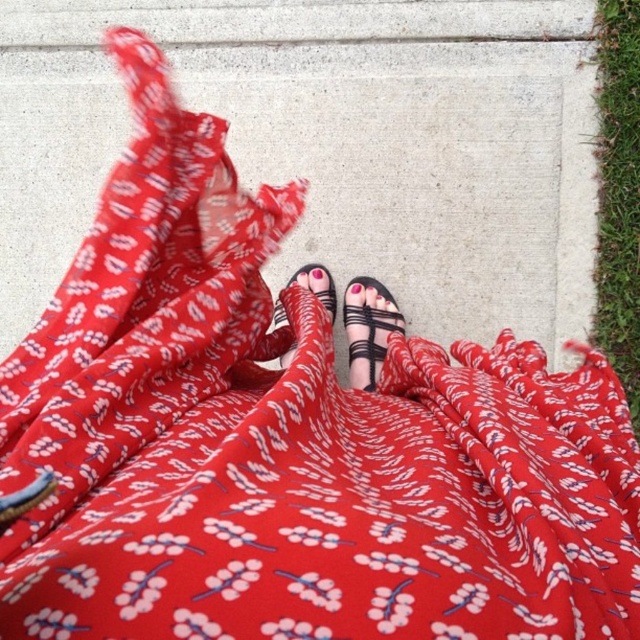
Question: Estimate the real-world distances between objects in this image. Which object is farther from the matte black sandal at center?

Choices:
 (A) green grass at right
 (B) black leather sandal at lower center

Answer: (A)

Question: Can you confirm if black leather sandal at lower center is positioned above matte black sandal at center?

Choices:
 (A) yes
 (B) no

Answer: (B)

Question: Which point is closer to the camera?

Choices:
 (A) black leather sandal at lower center
 (B) matte black sandal at center
 (C) green grass at right

Answer: (B)

Question: Which is farther from the green grass at right?

Choices:
 (A) matte black sandal at center
 (B) black leather sandal at lower center

Answer: (A)

Question: Can you confirm if green grass at right is positioned to the left of black leather sandal at lower center?

Choices:
 (A) yes
 (B) no

Answer: (B)

Question: Is green grass at right thinner than matte black sandal at center?

Choices:
 (A) yes
 (B) no

Answer: (A)